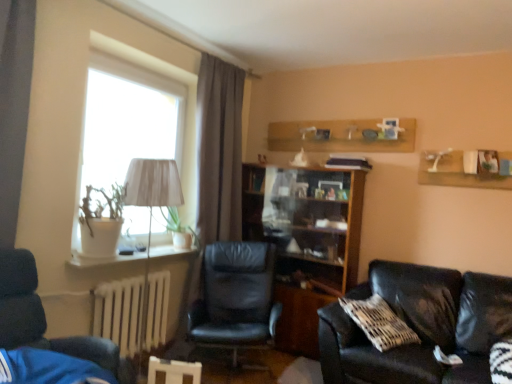
Question: Can we say black leather chair at center, which is the 1th chair in back-to-front order, lies outside wooden bookshelf at center?

Choices:
 (A) no
 (B) yes

Answer: (B)

Question: Is black leather chair at center, which ranks as the second chair in front-to-back order, to the right of wooden bookshelf at center from the viewer's perspective?

Choices:
 (A) yes
 (B) no

Answer: (B)

Question: Is black leather chair at center, which ranks as the second chair in front-to-back order, shorter than wooden bookshelf at center?

Choices:
 (A) yes
 (B) no

Answer: (A)

Question: Is black leather chair at center, the 2th chair in the left-to-right sequence, wider than wooden bookshelf at center?

Choices:
 (A) no
 (B) yes

Answer: (B)

Question: Does black leather chair at center, which is counted as the first chair, starting from the right, turn towards wooden bookshelf at center?

Choices:
 (A) no
 (B) yes

Answer: (A)

Question: From a real-world perspective, is black leather chair at center, which ranks as the second chair in front-to-back order, beneath wooden bookshelf at center?

Choices:
 (A) no
 (B) yes

Answer: (B)

Question: From a real-world perspective, is white painted metal radiator at lower left on black leather chair at center, the 2th chair in the left-to-right sequence?

Choices:
 (A) yes
 (B) no

Answer: (B)

Question: Can you confirm if white painted metal radiator at lower left is positioned to the left of black leather chair at center, which is the 1th chair in back-to-front order?

Choices:
 (A) no
 (B) yes

Answer: (B)

Question: Is white painted metal radiator at lower left not inside black leather chair at center, which ranks as the second chair in front-to-back order?

Choices:
 (A) no
 (B) yes

Answer: (B)

Question: Could you tell me if white painted metal radiator at lower left is facing black leather chair at center, the 2th chair in the left-to-right sequence?

Choices:
 (A) yes
 (B) no

Answer: (A)

Question: Is white painted metal radiator at lower left taller than black leather chair at center, the 2th chair in the left-to-right sequence?

Choices:
 (A) no
 (B) yes

Answer: (A)

Question: From the image's perspective, is white painted metal radiator at lower left located beneath black leather chair at center, which ranks as the second chair in front-to-back order?

Choices:
 (A) no
 (B) yes

Answer: (A)

Question: Considering the relative positions of white fabric lampshade at left and dark blue leather chair at left, the 2th chair viewed from the back, in the image provided, is white fabric lampshade at left behind dark blue leather chair at left, the 2th chair viewed from the back,?

Choices:
 (A) no
 (B) yes

Answer: (B)